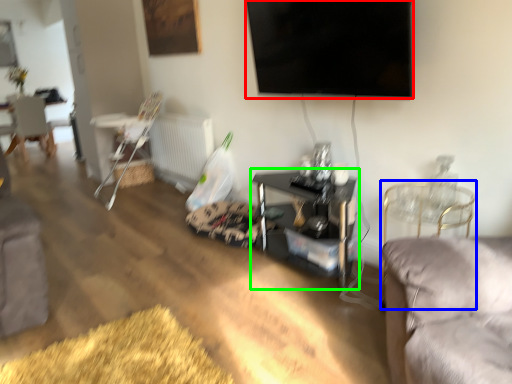
Question: Based on their relative distances, which object is nearer to television (highlighted by a red box)? Choose from chair (highlighted by a blue box) and table (highlighted by a green box).

Choices:
 (A) chair
 (B) table

Answer: (A)